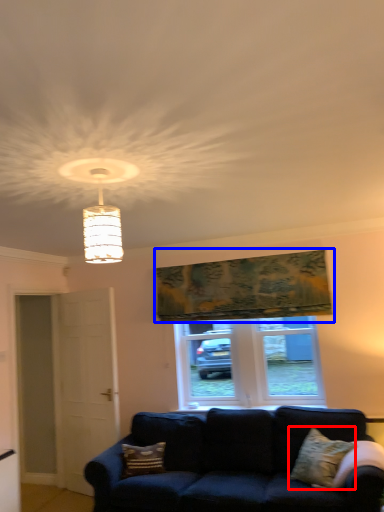
Question: Which point is closer to the camera, pillow (highlighted by a red box) or tapestry (highlighted by a blue box)?

Choices:
 (A) pillow
 (B) tapestry

Answer: (A)